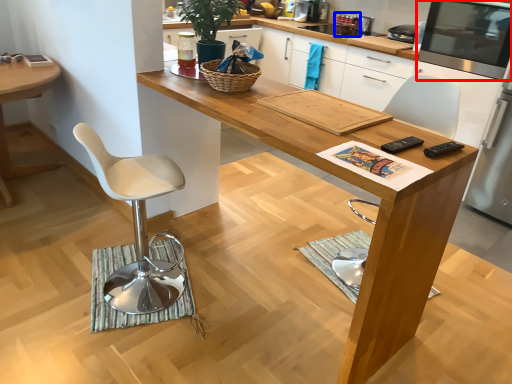
Question: Among these objects, which one is nearest to the camera, appliance (highlighted by a red box) or appliance (highlighted by a blue box)?

Choices:
 (A) appliance
 (B) appliance

Answer: (A)